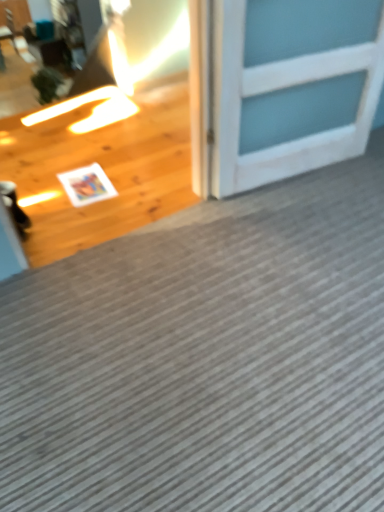
Question: Can you confirm if gray textured mat at center is smaller than white wooden door at upper right?

Choices:
 (A) yes
 (B) no

Answer: (B)

Question: From a real-world perspective, is gray textured mat at center below white wooden door at upper right?

Choices:
 (A) no
 (B) yes

Answer: (B)

Question: Is gray textured mat at center to the left of white wooden door at upper right from the viewer's perspective?

Choices:
 (A) yes
 (B) no

Answer: (A)

Question: Considering the relative sizes of gray textured mat at center and white wooden door at upper right in the image provided, is gray textured mat at center thinner than white wooden door at upper right?

Choices:
 (A) yes
 (B) no

Answer: (B)

Question: Is gray textured mat at center wider than white wooden door at upper right?

Choices:
 (A) no
 (B) yes

Answer: (B)

Question: Is gray textured mat at center bigger than white wooden door at upper right?

Choices:
 (A) no
 (B) yes

Answer: (B)

Question: From a real-world perspective, does white wooden door at upper right stand above gray textured mat at center?

Choices:
 (A) no
 (B) yes

Answer: (B)

Question: From the image's perspective, is white wooden door at upper right on top of gray textured mat at center?

Choices:
 (A) yes
 (B) no

Answer: (A)

Question: Does white wooden door at upper right have a lesser height compared to gray textured mat at center?

Choices:
 (A) no
 (B) yes

Answer: (A)

Question: Is the position of white wooden door at upper right less distant than that of gray textured mat at center?

Choices:
 (A) no
 (B) yes

Answer: (A)

Question: Does white wooden door at upper right turn towards gray textured mat at center?

Choices:
 (A) yes
 (B) no

Answer: (A)

Question: Can you see white wooden door at upper right touching gray textured mat at center?

Choices:
 (A) no
 (B) yes

Answer: (A)

Question: Considering the positions of gray textured mat at center and white wooden door at upper right in the image, is gray textured mat at center bigger or smaller than white wooden door at upper right?

Choices:
 (A) big
 (B) small

Answer: (A)